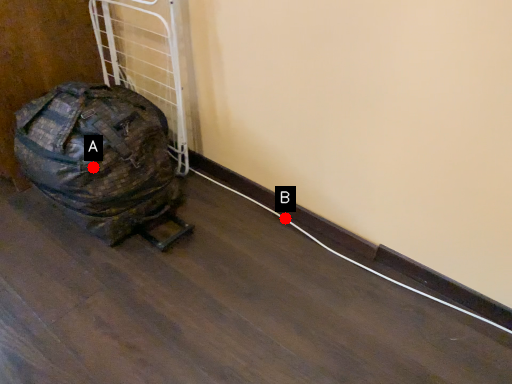
Question: Two points are circled on the image, labeled by A and B beside each circle. Which point is closer to the camera?

Choices:
 (A) A is closer
 (B) B is closer

Answer: (A)